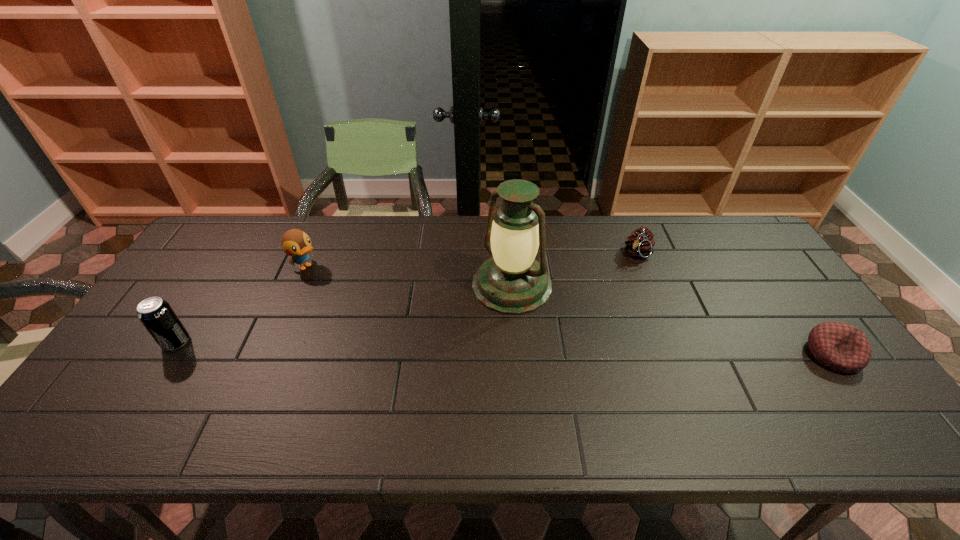
Identify the location of pinecone located in the far edge section of the desktop. (640, 243).

At what (x,y) coordinates should I click in order to perform the action: click on lantern located at the far edge. Please return your answer as a coordinate pair (x, y). The width and height of the screenshot is (960, 540). Looking at the image, I should click on (510, 282).

Identify the location of object that is at the near edge. This screenshot has width=960, height=540. (839, 346).

You are a GUI agent. You are given a task and a screenshot of the screen. Output one action in this format:
    pyautogui.click(x=<x>, y=<y>)
    Task: Click on the object present at the left edge
    The width and height of the screenshot is (960, 540).
    Given the screenshot: What is the action you would take?
    pyautogui.click(x=157, y=316)

Where is `object that is at the right edge`? The width and height of the screenshot is (960, 540). object that is at the right edge is located at coordinates (839, 346).

This screenshot has height=540, width=960. I want to click on object that is at the near right corner, so click(839, 346).

The width and height of the screenshot is (960, 540). Identify the location of blank space at the far edge. (392, 239).

The height and width of the screenshot is (540, 960). I want to click on vacant space at the near edge of the desktop, so click(x=777, y=399).

Locate an element on the screen. The image size is (960, 540). vacant area at the left edge of the desktop is located at coordinates (178, 360).

Find the location of a particular element. This screenshot has width=960, height=540. blank space at the far left corner of the desktop is located at coordinates (259, 225).